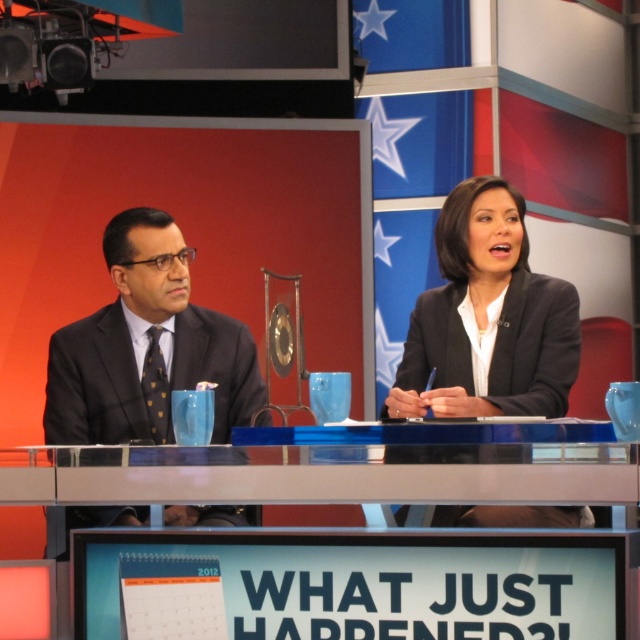
Which is below, blue plastic table at center or matte black suit at left?

blue plastic table at center

Between point (333, 454) and point (237, 404), which one is positioned behind?

The point (237, 404) is more distant.

The width and height of the screenshot is (640, 640). I want to click on blue plastic table at center, so click(352, 582).

Between blue plastic table at center and black glossy blazer at center, which one has less height?

blue plastic table at center

This screenshot has width=640, height=640. Describe the element at coordinates (352, 582) in the screenshot. I see `blue plastic table at center` at that location.

Between point (285, 596) and point (420, 385), which one is positioned behind?

Positioned behind is point (420, 385).

Locate an element on the screen. This screenshot has width=640, height=640. blue plastic table at center is located at coordinates (352, 582).

Where is `black glossy blazer at center`? black glossy blazer at center is located at coordinates point(486,317).

Does point (451, 234) lie behind point (192, 365)?

No, it is not.

What are the coordinates of `black glossy blazer at center` in the screenshot? It's located at (486, 317).